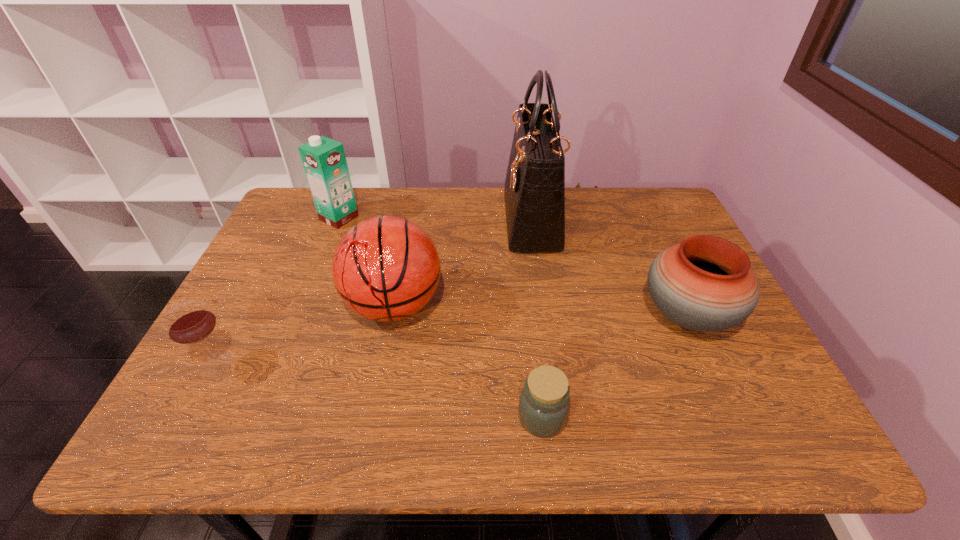
In order to click on vacant space that satisfies the following two spatial constraints: 1. at the front of the third shortest object with visible charms; 2. on the right side of the handbag in this screenshot , I will do `click(545, 315)`.

I want to click on free point that satisfies the following two spatial constraints: 1. at the front of the handbag with visible charms; 2. on the front side of the jar, so click(560, 417).

Locate an element on the screen. The height and width of the screenshot is (540, 960). vacant area that satisfies the following two spatial constraints: 1. at the front of the tallest object with visible charms; 2. on the side with spill of the basketball is located at coordinates (543, 305).